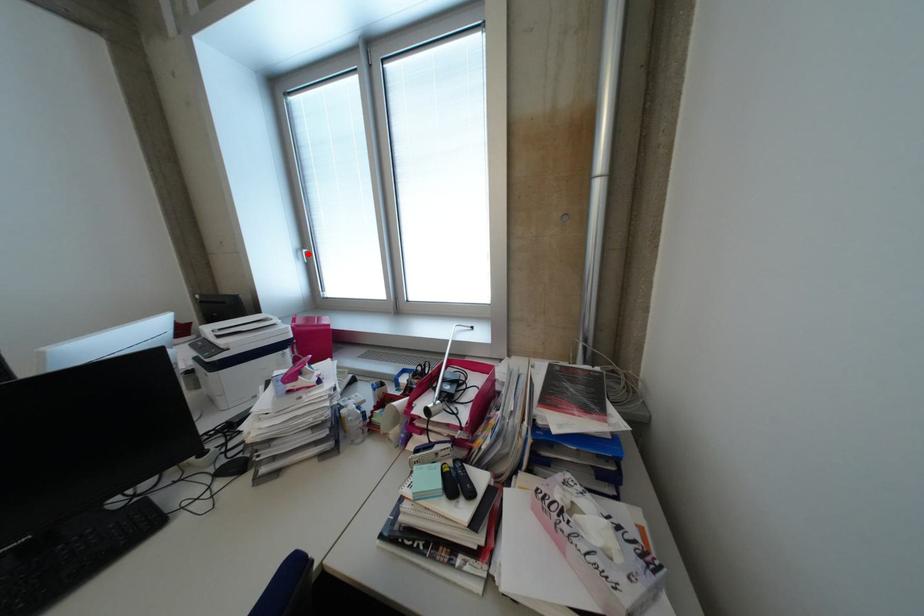
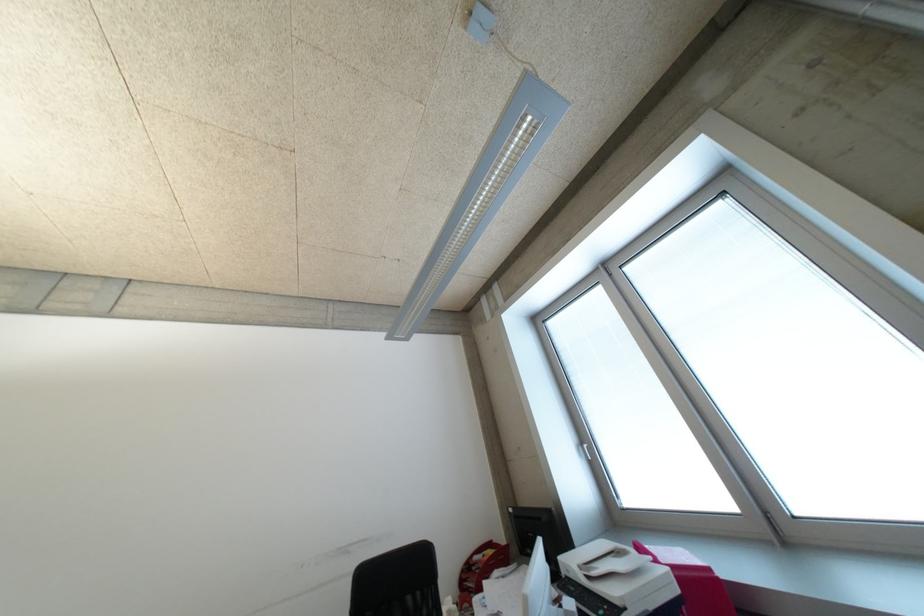
Question: I am providing you with two images of the same scene from different viewpoints. Given a red point in image1, look at the same physical point in image2. Is it:

Choices:
 (A) Closer to the viewpoint
 (B) Farther from the viewpoint

Answer: (B)